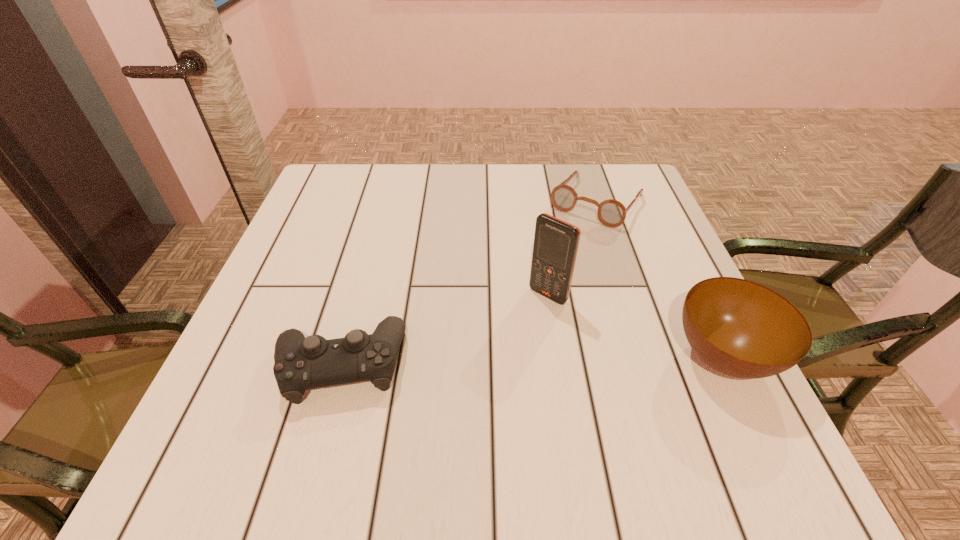
Find the location of a particular element. Image resolution: width=960 pixels, height=540 pixels. vacant space on the desktop that is between the third tallest object and the second tallest object and is positioned on the front-facing side of the spectacles is located at coordinates (478, 361).

Identify the location of free space on the desktop that is between the third tallest object and the bowl and is positioned on the screen of the tallest object. The width and height of the screenshot is (960, 540). (487, 361).